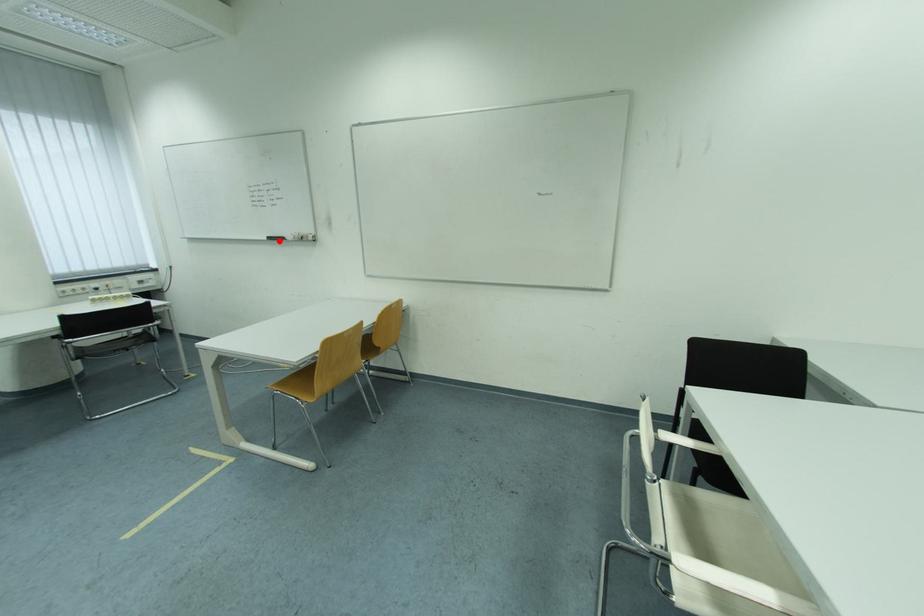
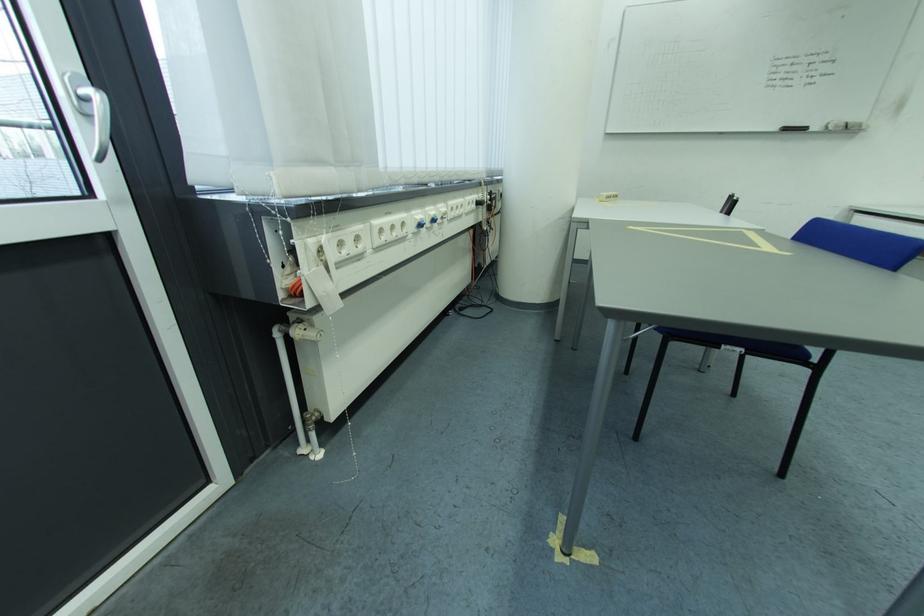
Question: I am providing you with two images of the same scene from different viewpoints. A red point is shown in image1. For the corresponding object point in image2, is it positioned nearer or farther from the camera?

Choices:
 (A) Nearer
 (B) Farther

Answer: (B)